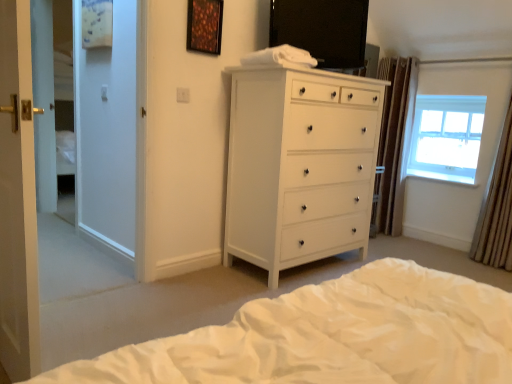
The width and height of the screenshot is (512, 384). What are the coordinates of `brown textured curtain at right, the 2th curtain from the right` in the screenshot? It's located at (393, 142).

The width and height of the screenshot is (512, 384). Describe the element at coordinates (18, 198) in the screenshot. I see `white glossy door at left` at that location.

This screenshot has width=512, height=384. Describe the element at coordinates (333, 336) in the screenshot. I see `white soft bed at lower center` at that location.

Where is `brown textured curtain at right, marked as the second curtain in a left-to-right arrangement`? brown textured curtain at right, marked as the second curtain in a left-to-right arrangement is located at coordinates (497, 207).

How many degrees apart are the facing directions of white soft bed at lower center and wooden frame at upper center?

white soft bed at lower center and wooden frame at upper center are facing 178 degrees away from each other.

Locate an element on the screen. The height and width of the screenshot is (384, 512). picture frame that is above the white soft bed at lower center (from the image's perspective) is located at coordinates (204, 26).

Is white soft bed at lower center touching wooden frame at upper center?

white soft bed at lower center and wooden frame at upper center are not in contact.

Is point (389, 350) more distant than point (207, 26)?

No, (389, 350) is in front of (207, 26).

Who is smaller, white glossy chest of drawers at center or white glossy door at left?

white glossy door at left is smaller.

Does point (347, 217) come farther from viewer compared to point (10, 162)?

Yes, it is.

From the image's perspective, between white glossy chest of drawers at center and white glossy door at left, who is located below?

white glossy door at left appears lower in the image.

Is the depth of white glossy chest of drawers at center greater than that of white glossy door at left?

Yes, the depth of white glossy chest of drawers at center is greater than that of white glossy door at left.

Where is `chest of drawers behind the white soft bed at lower center`? This screenshot has width=512, height=384. chest of drawers behind the white soft bed at lower center is located at coordinates (298, 165).

How much distance is there between white glossy chest of drawers at center and white soft bed at lower center?

white glossy chest of drawers at center is 4.73 feet away from white soft bed at lower center.

From the image's perspective, is white glossy chest of drawers at center on top of white soft bed at lower center?

Yes, from the image's perspective, white glossy chest of drawers at center is over white soft bed at lower center.

From a real-world perspective, relative to white soft bed at lower center, is white glossy chest of drawers at center vertically above or below?

white glossy chest of drawers at center is above white soft bed at lower center.

Could you tell me if brown textured curtain at right, the 1th curtain when ordered from back to front, is turned towards white soft bed at lower center?

No, brown textured curtain at right, the 1th curtain when ordered from back to front, is not turned towards white soft bed at lower center.

Which object is closer to the camera taking this photo, brown textured curtain at right, the 2th curtain viewed from the front, or white soft bed at lower center?

white soft bed at lower center.

Could you measure the distance between brown textured curtain at right, the first curtain viewed from the left, and white soft bed at lower center?

brown textured curtain at right, the first curtain viewed from the left, is 2.89 meters from white soft bed at lower center.

Would you say brown textured curtain at right, the 1th curtain when ordered from back to front, is to the left or to the right of white soft bed at lower center in the picture?

Based on their positions, brown textured curtain at right, the 1th curtain when ordered from back to front, is located to the right of white soft bed at lower center.

Considering the relative positions of white glossy chest of drawers at center and wooden frame at upper center in the image provided, is white glossy chest of drawers at center to the right of wooden frame at upper center from the viewer's perspective?

Yes.

Considering the relative sizes of white glossy chest of drawers at center and wooden frame at upper center in the image provided, is white glossy chest of drawers at center taller than wooden frame at upper center?

Correct, white glossy chest of drawers at center is much taller as wooden frame at upper center.

Is point (312, 195) behind point (196, 31)?

Yes.

Is white soft bed at lower center turned away from transparent glass window at upper right?

No, white soft bed at lower center is not facing the opposite direction of transparent glass window at upper right.

Looking at their sizes, would you say white soft bed at lower center is wider or thinner than transparent glass window at upper right?

In the image, white soft bed at lower center appears to be wider than transparent glass window at upper right.

Considering the relative positions of white soft bed at lower center and transparent glass window at upper right in the image provided, is white soft bed at lower center to the left or to the right of transparent glass window at upper right?

From the image, it's evident that white soft bed at lower center is to the left of transparent glass window at upper right.

From the image's perspective, which is below, white soft bed at lower center or transparent glass window at upper right?

white soft bed at lower center is shown below in the image.

Is brown textured curtain at right, which is the first curtain from right to left, facing towards transparent glass window at upper right?

No, brown textured curtain at right, which is the first curtain from right to left, does not turn towards transparent glass window at upper right.

Which is less distant, (508, 212) or (463, 100)?

The point (508, 212) is more forward.

Considering the relative positions of brown textured curtain at right, marked as the second curtain in a left-to-right arrangement, and transparent glass window at upper right in the image provided, is brown textured curtain at right, marked as the second curtain in a left-to-right arrangement, behind transparent glass window at upper right?

No, the depth of brown textured curtain at right, marked as the second curtain in a left-to-right arrangement, is less than that of transparent glass window at upper right.

Identify the location of bed on the right of wooden frame at upper center. This screenshot has width=512, height=384. (333, 336).

I want to click on chest of drawers below the white glossy door at left (from a real-world perspective), so click(298, 165).

From the image, which object appears to be nearer to wooden frame at upper center, brown textured curtain at right, the 1th curtain when ordered from back to front, or white glossy door at left?

white glossy door at left is positioned closer to the anchor wooden frame at upper center.

Which object lies further to the anchor point transparent glass window at upper right, brown textured curtain at right, the first curtain viewed from the left, or white glossy door at left?

white glossy door at left.

Looking at the image, which one is located further to white soft bed at lower center, brown textured curtain at right, the 2th curtain viewed from the front, or wooden frame at upper center?

brown textured curtain at right, the 2th curtain viewed from the front.

From the image, which object appears to be nearer to wooden frame at upper center, white soft bed at lower center or transparent glass window at upper right?

white soft bed at lower center is positioned closer to the anchor wooden frame at upper center.

When comparing their distances from transparent glass window at upper right, does white glossy door at left or wooden frame at upper center seem further?

Among the two, white glossy door at left is located further to transparent glass window at upper right.

Looking at the image, which one is located closer to white soft bed at lower center, brown textured curtain at right, marked as the second curtain in a left-to-right arrangement, or brown textured curtain at right, the 2th curtain from the right?

Based on the image, brown textured curtain at right, marked as the second curtain in a left-to-right arrangement, appears to be nearer to white soft bed at lower center.

Considering their positions, is transparent glass window at upper right positioned further to white soft bed at lower center than white glossy door at left?

transparent glass window at upper right.

Based on their spatial positions, is transparent glass window at upper right or wooden frame at upper center further from white glossy door at left?

transparent glass window at upper right lies further to white glossy door at left than the other object.

Where is `screen door located between white soft bed at lower center and transparent glass window at upper right in the depth direction`? Image resolution: width=512 pixels, height=384 pixels. screen door located between white soft bed at lower center and transparent glass window at upper right in the depth direction is located at coordinates (18, 198).

Find the location of a particular element. The image size is (512, 384). window between white glossy chest of drawers at center and brown textured curtain at right, marked as the second curtain in a left-to-right arrangement, from left to right is located at coordinates (446, 137).

Locate an element on the screen. Image resolution: width=512 pixels, height=384 pixels. curtain between white soft bed at lower center and brown textured curtain at right, the first curtain viewed from the left, in the front-back direction is located at coordinates (497, 207).

Identify the location of picture frame located between white glossy door at left and brown textured curtain at right, the 1th curtain when ordered from back to front, in the depth direction. (204, 26).